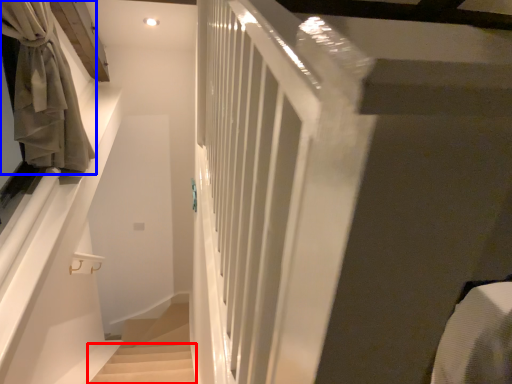
Question: Which of the following is the closest to the observer, stairs (highlighted by a red box) or curtain (highlighted by a blue box)?

Choices:
 (A) stairs
 (B) curtain

Answer: (B)